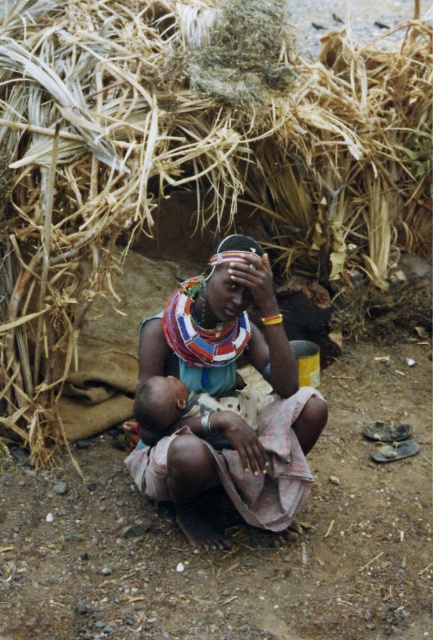
Based on the scene described, where is the brown straw at upper center located in relation to the multicolored fabric at center?

The brown straw at upper center is to the left of the multicolored fabric at center.

Consider the image. What is located at the point with coordinates [190,157] in the image?

The point at coordinates [190,157] marks brown straw at upper center.